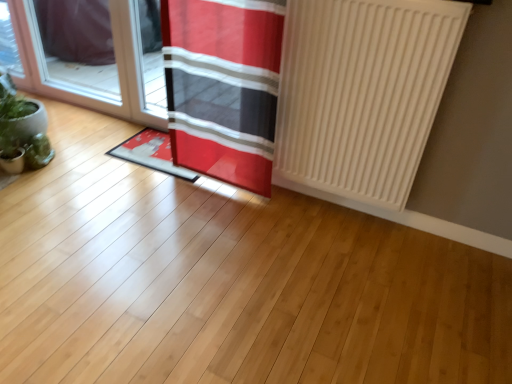
Question: Considering the relative positions of white matte radiator at right and green matte plant at left in the image provided, is white matte radiator at right behind green matte plant at left?

Choices:
 (A) yes
 (B) no

Answer: (B)

Question: From a real-world perspective, is white matte radiator at right beneath green matte plant at left?

Choices:
 (A) yes
 (B) no

Answer: (B)

Question: From a real-world perspective, is white matte radiator at right physically above green matte plant at left?

Choices:
 (A) yes
 (B) no

Answer: (A)

Question: Does white matte radiator at right touch green matte plant at left?

Choices:
 (A) yes
 (B) no

Answer: (B)

Question: Considering the relative sizes of white matte radiator at right and green matte plant at left in the image provided, is white matte radiator at right bigger than green matte plant at left?

Choices:
 (A) yes
 (B) no

Answer: (A)

Question: Looking at the image, does green matte plant at left seem bigger or smaller compared to white matte radiator at right?

Choices:
 (A) small
 (B) big

Answer: (A)

Question: From a real-world perspective, is green matte plant at left above or below white matte radiator at right?

Choices:
 (A) below
 (B) above

Answer: (A)

Question: Considering their positions, is green matte plant at left located in front of or behind white matte radiator at right?

Choices:
 (A) behind
 (B) front

Answer: (A)

Question: Considering the positions of point (31, 153) and point (440, 87), is point (31, 153) closer or farther from the camera than point (440, 87)?

Choices:
 (A) closer
 (B) farther

Answer: (B)

Question: Looking at their shapes, would you say transparent glass door at left is wider or thinner than red fabric doormat at center?

Choices:
 (A) wide
 (B) thin

Answer: (B)

Question: In the image, is transparent glass door at left positioned in front of or behind red fabric doormat at center?

Choices:
 (A) behind
 (B) front

Answer: (A)

Question: From their relative heights in the image, would you say transparent glass door at left is taller or shorter than red fabric doormat at center?

Choices:
 (A) short
 (B) tall

Answer: (B)

Question: From a real-world perspective, is transparent glass door at left physically located above or below red fabric doormat at center?

Choices:
 (A) below
 (B) above

Answer: (B)

Question: Is red fabric curtain at center taller or shorter than green matte plant at left?

Choices:
 (A) short
 (B) tall

Answer: (B)

Question: Considering the positions of red fabric curtain at center and green matte plant at left in the image, is red fabric curtain at center bigger or smaller than green matte plant at left?

Choices:
 (A) big
 (B) small

Answer: (A)